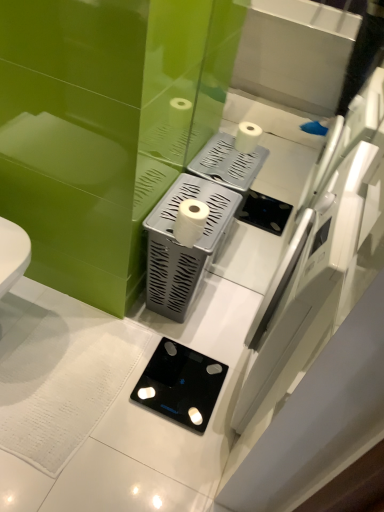
Question: Is silver textured tissue holder at center in front of or behind white matte toilet paper at center in the image?

Choices:
 (A) behind
 (B) front

Answer: (A)

Question: Based on their sizes in the image, would you say silver textured tissue holder at center is bigger or smaller than white matte toilet paper at center?

Choices:
 (A) small
 (B) big

Answer: (B)

Question: Considering the real-world distances, which object is closest to the silver textured tissue holder at center?

Choices:
 (A) white matte toilet paper at center
 (B) black glass scale at lower center

Answer: (A)

Question: Which is farther from the silver textured tissue holder at center?

Choices:
 (A) white matte toilet paper at center
 (B) black glass scale at lower center

Answer: (B)